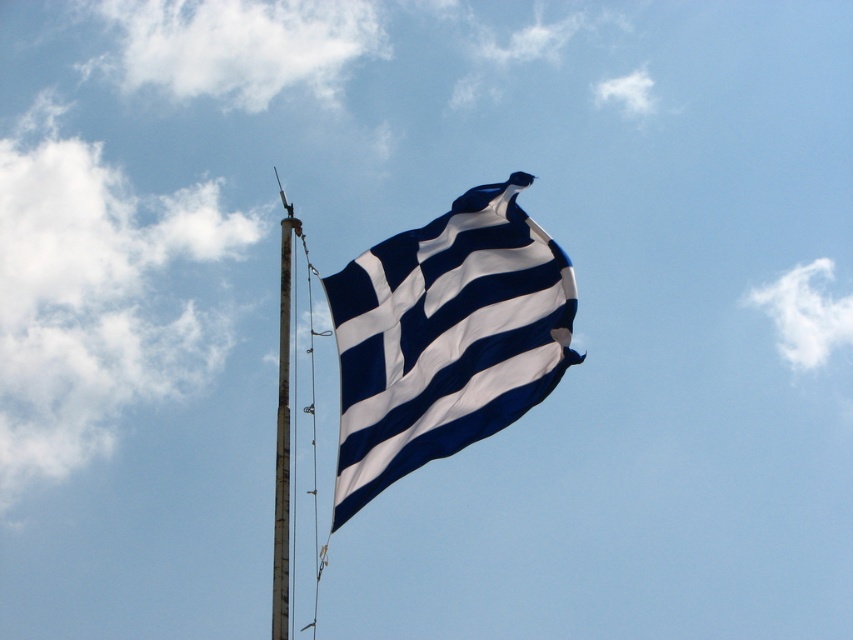
Is blue/white fabric flag at center taller than smooth metal pole at center?

In fact, blue/white fabric flag at center may be shorter than smooth metal pole at center.

Who is higher up, blue/white fabric flag at center or smooth metal pole at center?

blue/white fabric flag at center is higher up.

Which is behind, point (570, 349) or point (276, 445)?

The point (276, 445) is behind.

The width and height of the screenshot is (853, 640). What are the coordinates of `blue/white fabric flag at center` in the screenshot? It's located at (445, 337).